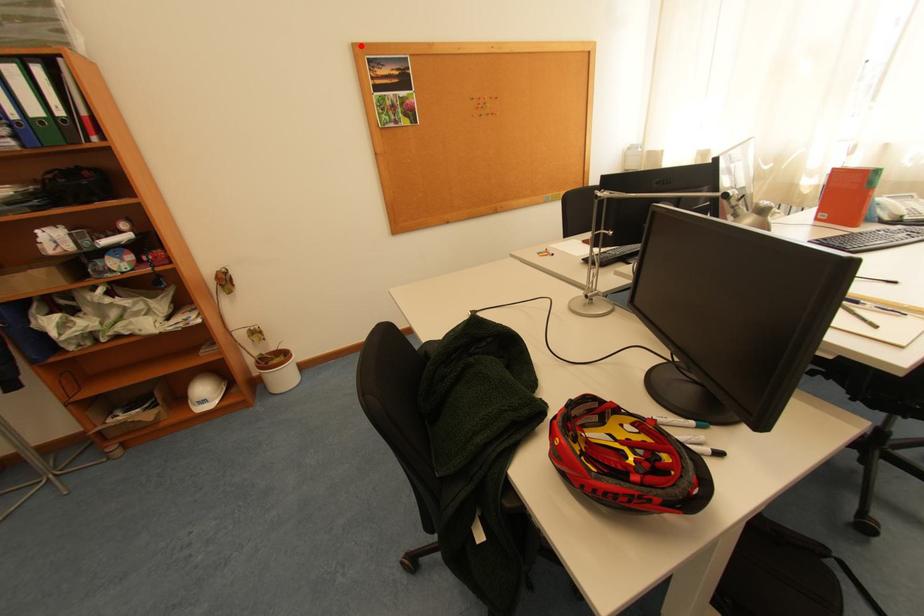
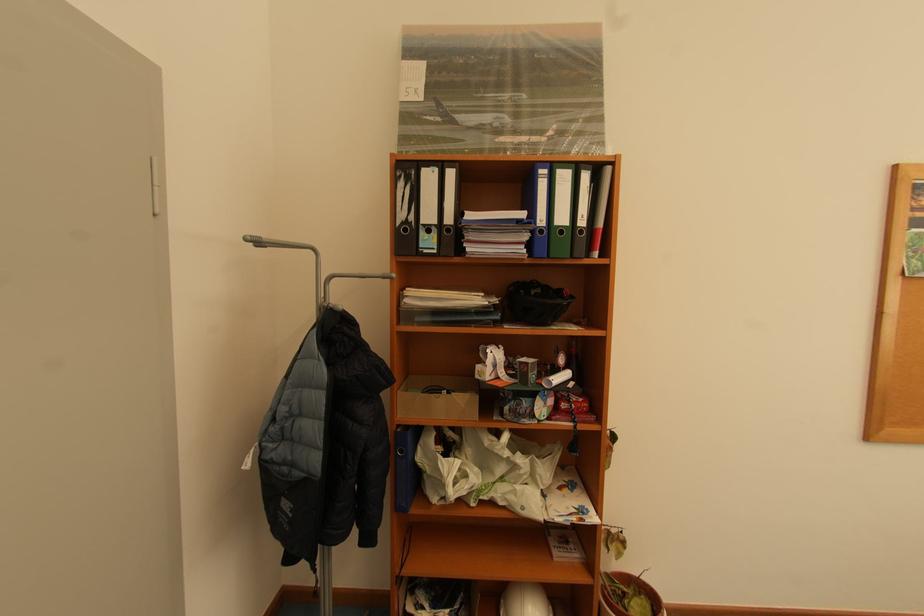
Locate, in the second image, the point that corresponds to the highlighted location in the first image.

(904, 167)